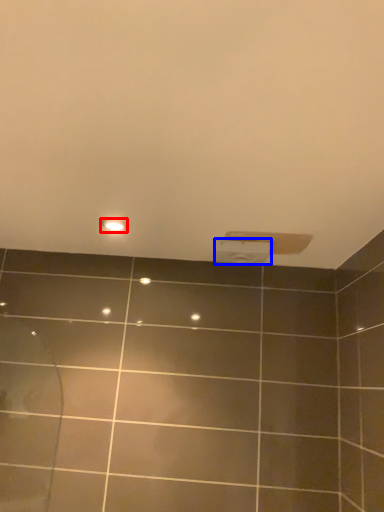
Question: Among these objects, which one is nearest to the camera, light fixture (highlighted by a red box) or toilet paper (highlighted by a blue box)?

Choices:
 (A) light fixture
 (B) toilet paper

Answer: (A)